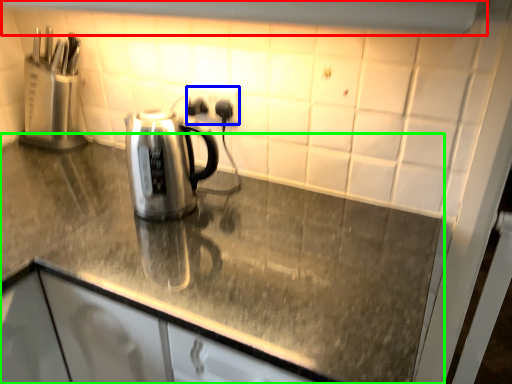
Question: Based on their relative distances, which object is farther from exhaust hood (highlighted by a red box)? Choose from electric outlet (highlighted by a blue box) and countertop (highlighted by a green box).

Choices:
 (A) electric outlet
 (B) countertop

Answer: (B)